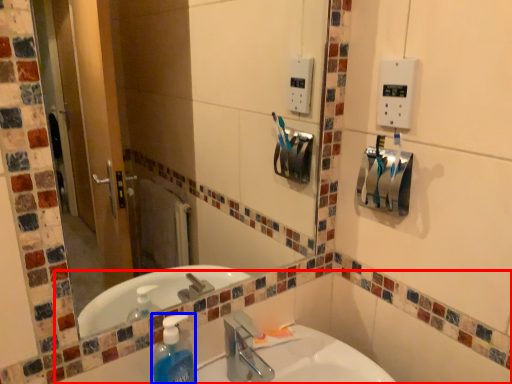
Question: Which of the following is the closest to the observer, bath (highlighted by a red box) or cleaning product (highlighted by a blue box)?

Choices:
 (A) bath
 (B) cleaning product

Answer: (A)